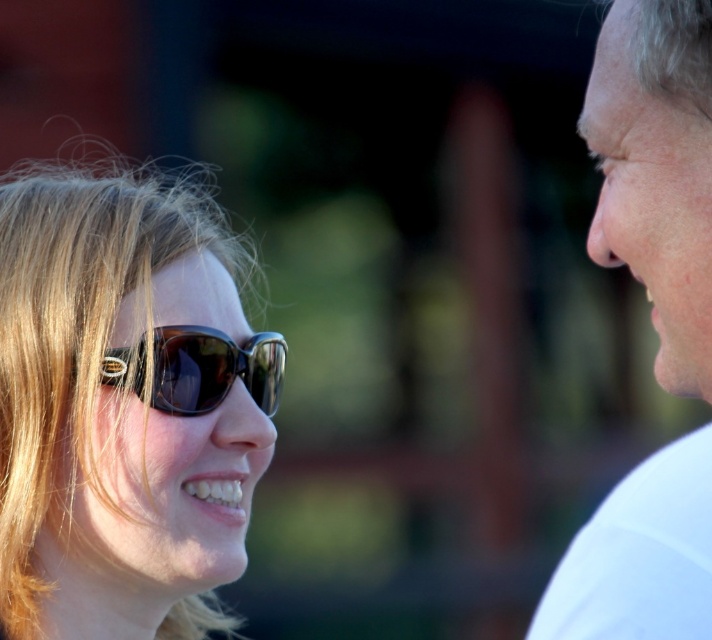
Question: Is white matte face at right wider than matte black sunglasses at center?

Choices:
 (A) yes
 (B) no

Answer: (A)

Question: Estimate the real-world distances between objects in this image. Which object is farther from the matte black sunglasses at center?

Choices:
 (A) white matte face at right
 (B) matte brown sunglasses at left

Answer: (A)

Question: Which of the following is the closest to the observer?

Choices:
 (A) white matte face at right
 (B) matte brown sunglasses at left

Answer: (A)

Question: Does matte brown sunglasses at left have a smaller size compared to matte black sunglasses at center?

Choices:
 (A) no
 (B) yes

Answer: (A)

Question: Does white matte face at right have a larger size compared to matte black sunglasses at center?

Choices:
 (A) no
 (B) yes

Answer: (B)

Question: Among these points, which one is nearest to the camera?

Choices:
 (A) (649, 56)
 (B) (162, 532)

Answer: (A)